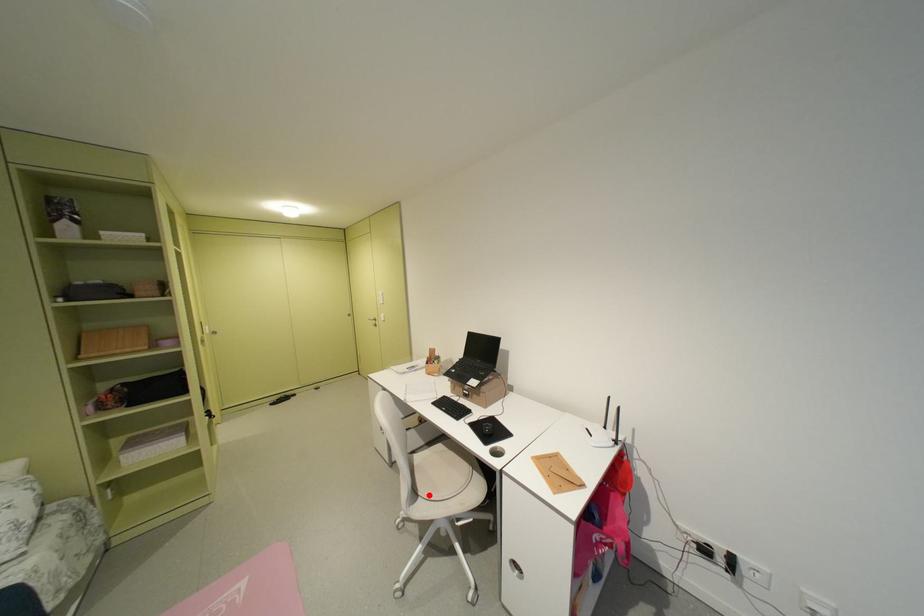
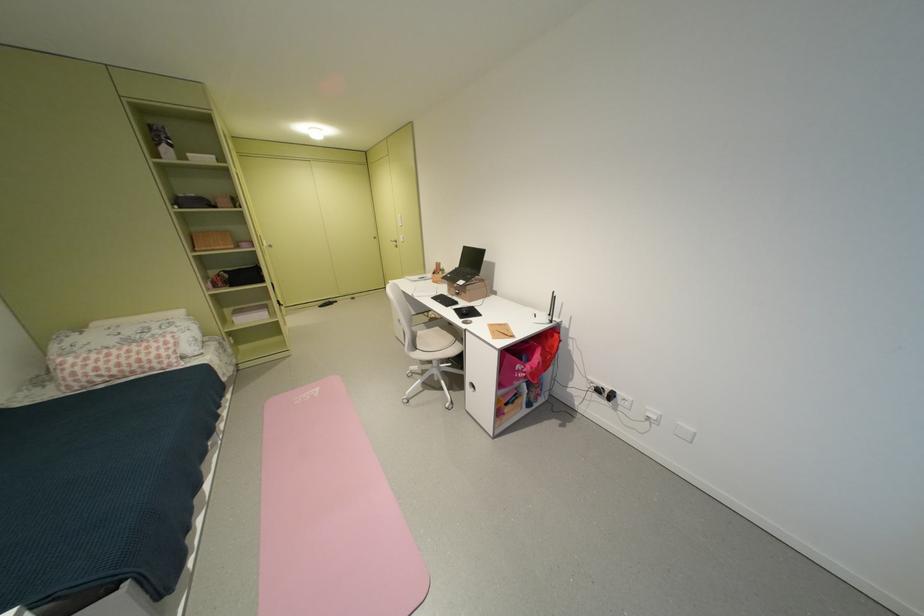
Question: I am providing you with two images of the same scene from different viewpoints. In image1, a red point is highlighted. Considering the same 3D point in image2, which of the following is correct?

Choices:
 (A) It is closer
 (B) It is farther

Answer: (B)